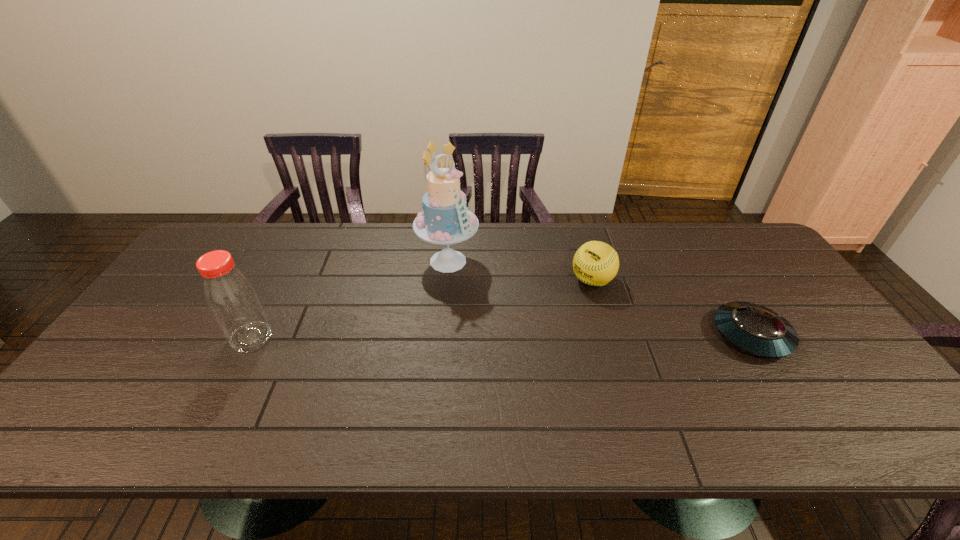
At what (x,y) coordinates should I click in order to perform the action: click on vacant space situated on the logo side of the softball. Please return your answer as a coordinate pair (x, y). The image size is (960, 540). Looking at the image, I should click on (548, 314).

Where is `vacant space positioned 0.350m on the logo side of the softball`? vacant space positioned 0.350m on the logo side of the softball is located at coordinates (494, 355).

Where is `blank space located 0.390m on the logo side of the softball`? This screenshot has height=540, width=960. blank space located 0.390m on the logo side of the softball is located at coordinates (483, 363).

Identify the location of vacant space located with a ladder on the side of the third object from right to left. (466, 300).

Identify the location of vacant space located 0.380m with a ladder on the side of the third object from right to left. (502, 379).

At what (x,y) coordinates should I click in order to perform the action: click on vacant region located 0.260m with a ladder on the side of the third object from right to left. Please return your answer as a coordinate pair (x, y). Image resolution: width=960 pixels, height=540 pixels. Looking at the image, I should click on (486, 343).

Where is `softball present at the far edge`? softball present at the far edge is located at coordinates (595, 263).

Find the location of a particular element. This screenshot has height=540, width=960. cake that is at the far edge is located at coordinates (446, 220).

The width and height of the screenshot is (960, 540). I want to click on object at the right edge, so click(757, 330).

This screenshot has height=540, width=960. Identify the location of vacant space at the far edge of the desktop. (363, 223).